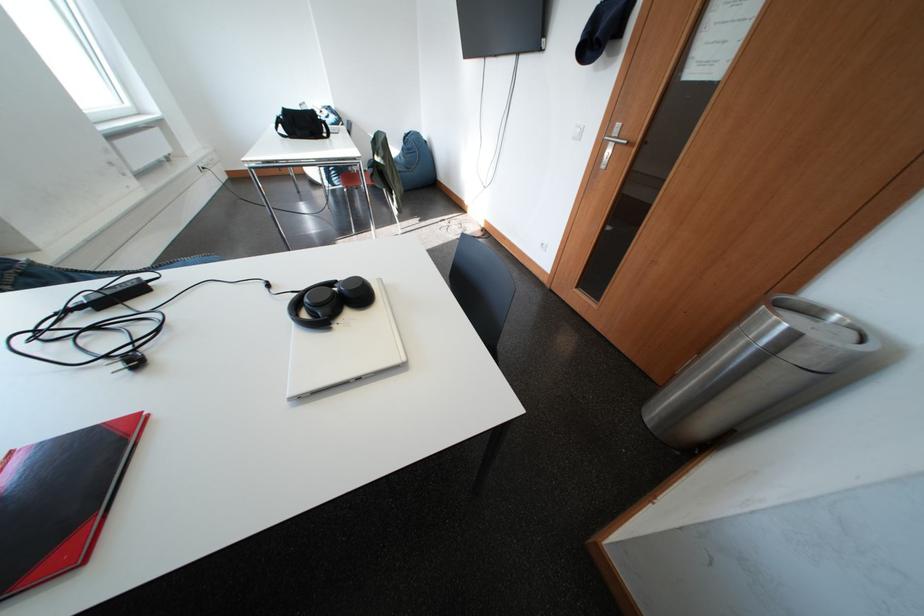
At what (x,y) coordinates should I click in order to perform the action: click on silver door handle. Please return your answer as a coordinate pair (x, y). Looking at the image, I should click on (614, 140).